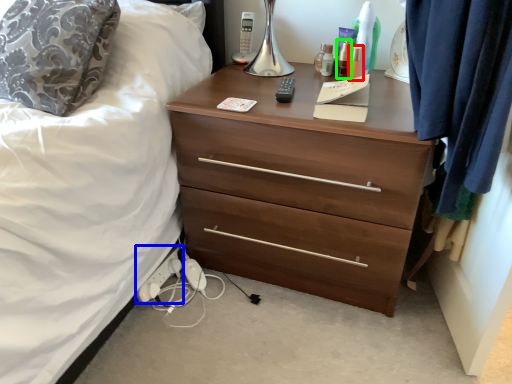
Question: Which object is the farthest from toiletry (highlighted by a red box)? Choose among these: extension cord (highlighted by a blue box) or toiletry (highlighted by a green box).

Choices:
 (A) extension cord
 (B) toiletry

Answer: (A)